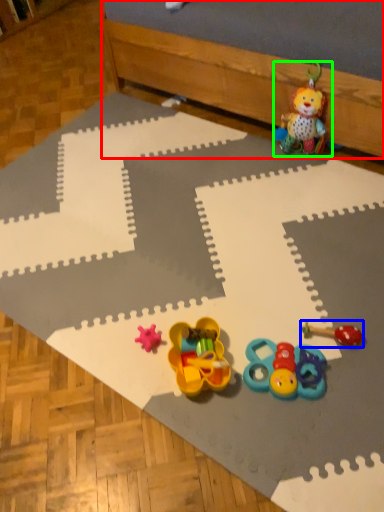
Question: Based on their relative distances, which object is nearer to bed frame (highlighted by a red box)? Choose from toy (highlighted by a blue box) and toy (highlighted by a green box).

Choices:
 (A) toy
 (B) toy

Answer: (B)